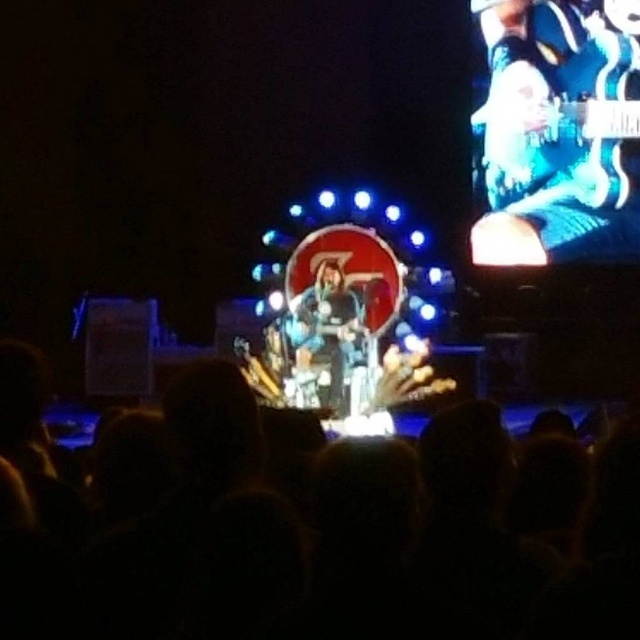
Who is more distant from viewer, (285, 564) or (561, 26)?

Point (561, 26)

Consider the image. Is silhouette hair at center above blue metallic guitar at upper right?

No, silhouette hair at center is not above blue metallic guitar at upper right.

Where is `silhouette hair at center`? silhouette hair at center is located at coordinates (326, 536).

Can you confirm if silhouette hair at center is wider than shiny black guitar at center?

Yes, silhouette hair at center is wider than shiny black guitar at center.

Who is more forward, (227, 556) or (305, 296)?

Point (227, 556)

Identify the location of silhouette hair at center. This screenshot has height=640, width=640. (326, 536).

The height and width of the screenshot is (640, 640). What are the coordinates of `silhouette hair at center` in the screenshot? It's located at (326, 536).

Who is positioned more to the right, blue metallic guitar at upper right or shiny black guitar at center?

From the viewer's perspective, blue metallic guitar at upper right appears more on the right side.

Does blue metallic guitar at upper right lie behind shiny black guitar at center?

Yes, blue metallic guitar at upper right is further from the viewer.

Who is more forward, [566,17] or [328,285]?

Point [328,285] is in front.

What are the coordinates of `blue metallic guitar at upper right` in the screenshot? It's located at (557, 132).